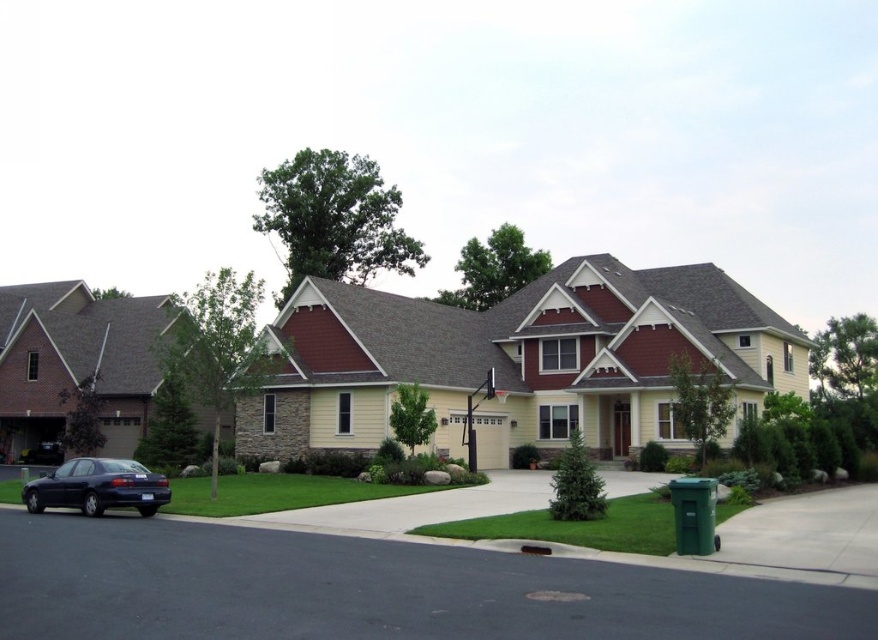
You are standing at the front entrance of the house and want to walk to the asphalt at lower center. According to the coordinates provided, what direction should you move in?

The asphalt at lower center is located at coordinates point (372, 589). Since you are at the front entrance, you should move towards the lower center direction to reach it.

You are a delivery driver who needs to park your truck, which is 2 meters wide, in the driveway. The driveway is paved with asphalt at lower center. Can you park your truck there without overlapping the shiny dark blue sedan at lower left?

Result: The asphalt at lower center is smaller than the shiny dark blue sedan at lower left. Since the sedan is larger, the asphalt area might not be wide enough to accommodate a 2 meter wide truck without overlapping the sedan.